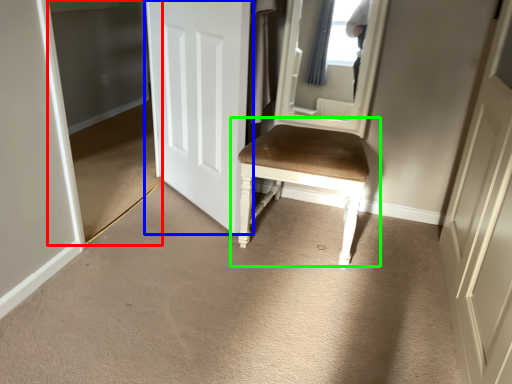
Question: Which object is positioned farthest from glass door (highlighted by a red box)? Select from door (highlighted by a blue box) and chair (highlighted by a green box).

Choices:
 (A) door
 (B) chair

Answer: (B)